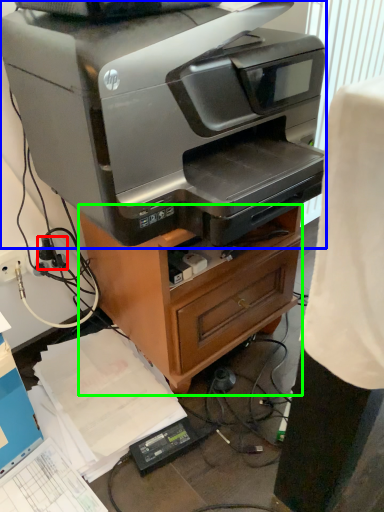
Question: Based on their relative distances, which object is nearer to plug (highlighted by a red box)? Choose from printer (highlighted by a blue box) and furniture (highlighted by a green box).

Choices:
 (A) printer
 (B) furniture

Answer: (B)